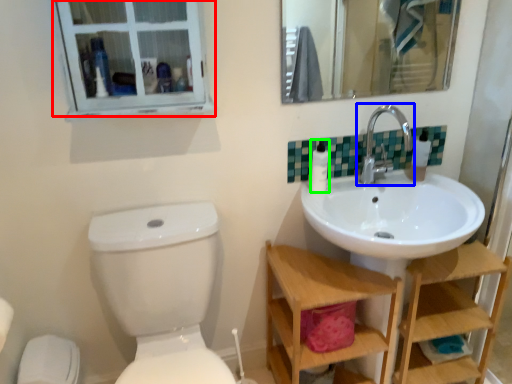
Question: Which object is positioned closest to window (highlighted by a red box)? Select from tap (highlighted by a blue box) and toilet paper (highlighted by a green box).

Choices:
 (A) tap
 (B) toilet paper

Answer: (B)